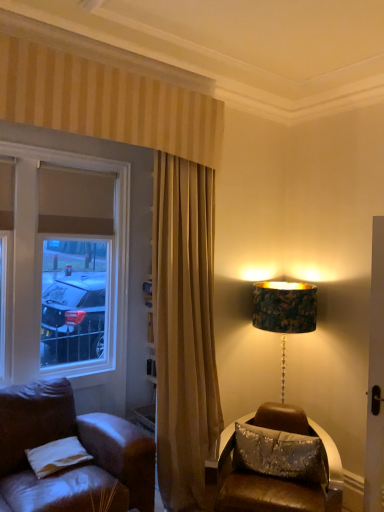
Identify the location of white fabric pillow at lower left, the 2th pillow in the right-to-left sequence. Image resolution: width=384 pixels, height=512 pixels. (56, 456).

What do you see at coordinates (111, 256) in the screenshot? I see `matte glass window at left` at bounding box center [111, 256].

Locate an element on the screen. matte glass window at left is located at coordinates (111, 256).

This screenshot has height=512, width=384. Find the location of `sparkly silver pillow at lower right, which is the 1th pillow from right to left`. sparkly silver pillow at lower right, which is the 1th pillow from right to left is located at coordinates (280, 454).

At what (x,y) coordinates should I click in order to perform the action: click on white fabric pillow at lower left, the 2th pillow in the right-to-left sequence. Please return your answer as a coordinate pair (x, y). Looking at the image, I should click on (56, 456).

How distant is white fabric pillow at lower left, arranged as the first pillow when viewed from the left, from sparkly silver pillow at lower right, the second pillow positioned from the left?

A distance of 3.82 feet exists between white fabric pillow at lower left, arranged as the first pillow when viewed from the left, and sparkly silver pillow at lower right, the second pillow positioned from the left.

Is white fabric pillow at lower left, arranged as the first pillow when viewed from the left, spatially inside sparkly silver pillow at lower right, which is the 1th pillow from right to left, or outside of it?

white fabric pillow at lower left, arranged as the first pillow when viewed from the left, is not inside sparkly silver pillow at lower right, which is the 1th pillow from right to left, it's outside.

Is white fabric pillow at lower left, arranged as the first pillow when viewed from the left, bigger than sparkly silver pillow at lower right, which is the 1th pillow from right to left?

No.

From the image's perspective, between white fabric pillow at lower left, the 2th pillow in the right-to-left sequence, and sparkly silver pillow at lower right, which is the 1th pillow from right to left, who is located below?

From the image's view, white fabric pillow at lower left, the 2th pillow in the right-to-left sequence, is below.

Can you confirm if matte glass window at left is bigger than sparkly silver pillow at lower right, the second pillow positioned from the left?

Yes.

Which object is further away from the camera, matte glass window at left or sparkly silver pillow at lower right, which is the 1th pillow from right to left?

Positioned behind is matte glass window at left.

Does matte glass window at left appear on the right side of sparkly silver pillow at lower right, which is the 1th pillow from right to left?

No.

Would you say white fabric pillow at lower left, the 2th pillow in the right-to-left sequence, is outside shiny brown leather chair at lower right?

Yes, white fabric pillow at lower left, the 2th pillow in the right-to-left sequence, is not within shiny brown leather chair at lower right.

From the picture: Is white fabric pillow at lower left, arranged as the first pillow when viewed from the left, beside shiny brown leather chair at lower right?

No, white fabric pillow at lower left, arranged as the first pillow when viewed from the left, is not with shiny brown leather chair at lower right.

Which point is more forward, (x=71, y=450) or (x=231, y=443)?

Point (x=71, y=450)

Consider the image. Which is closer, (x=113, y=307) or (x=54, y=453)?

Point (x=113, y=307).

Between matte glass window at left and white fabric pillow at lower left, arranged as the first pillow when viewed from the left, which one has larger width?

white fabric pillow at lower left, arranged as the first pillow when viewed from the left.

From the image's perspective, is matte glass window at left over white fabric pillow at lower left, arranged as the first pillow when viewed from the left?

Yes.

Is sparkly silver pillow at lower right, which is the 1th pillow from right to left, facing away from shiny brown leather chair at lower right?

Yes, sparkly silver pillow at lower right, which is the 1th pillow from right to left, is positioned with its back facing shiny brown leather chair at lower right.

Does sparkly silver pillow at lower right, the second pillow positioned from the left, have a smaller size compared to shiny brown leather chair at lower right?

Indeed, sparkly silver pillow at lower right, the second pillow positioned from the left, has a smaller size compared to shiny brown leather chair at lower right.

From the picture: From the image's perspective, which is above, sparkly silver pillow at lower right, which is the 1th pillow from right to left, or shiny brown leather chair at lower right?

sparkly silver pillow at lower right, which is the 1th pillow from right to left, appears higher in the image.

Is sparkly silver pillow at lower right, which is the 1th pillow from right to left, next to shiny brown leather chair at lower right?

Indeed, sparkly silver pillow at lower right, which is the 1th pillow from right to left, and shiny brown leather chair at lower right are beside each other and touching.

Is matte glass window at left positioned far away from shiny brown leather chair at lower right?

Yes.

From a real-world perspective, is matte glass window at left physically above shiny brown leather chair at lower right?

Yes, from a real-world perspective, matte glass window at left is on top of shiny brown leather chair at lower right.

Does matte glass window at left have a larger size compared to shiny brown leather chair at lower right?

Actually, matte glass window at left might be smaller than shiny brown leather chair at lower right.

Find the location of a particular element. window on the left of shiny brown leather chair at lower right is located at coordinates (111, 256).

Would you say white fabric pillow at lower left, the 2th pillow in the right-to-left sequence, is inside or outside matte glass window at left?

white fabric pillow at lower left, the 2th pillow in the right-to-left sequence, is not enclosed by matte glass window at left.

Who is shorter, white fabric pillow at lower left, the 2th pillow in the right-to-left sequence, or matte glass window at left?

With less height is white fabric pillow at lower left, the 2th pillow in the right-to-left sequence.

Is white fabric pillow at lower left, the 2th pillow in the right-to-left sequence, smaller than matte glass window at left?

Indeed, white fabric pillow at lower left, the 2th pillow in the right-to-left sequence, has a smaller size compared to matte glass window at left.

Is white fabric pillow at lower left, arranged as the first pillow when viewed from the left, wider or thinner than matte glass window at left?

Considering their sizes, white fabric pillow at lower left, arranged as the first pillow when viewed from the left, looks broader than matte glass window at left.

The image size is (384, 512). In order to click on pillow below the sparkly silver pillow at lower right, the second pillow positioned from the left (from a real-world perspective) in this screenshot , I will do coord(56,456).

This screenshot has height=512, width=384. There is a sparkly silver pillow at lower right, the second pillow positioned from the left. What are the coordinates of `window above it (from a real-world perspective)` in the screenshot? It's located at (111, 256).

Based on the photo, considering their positions, is shiny brown leather chair at lower right positioned closer to sparkly silver pillow at lower right, which is the 1th pillow from right to left, than white fabric pillow at lower left, the 2th pillow in the right-to-left sequence?

Based on the image, shiny brown leather chair at lower right appears to be nearer to sparkly silver pillow at lower right, which is the 1th pillow from right to left.

Looking at the image, which one is located closer to sparkly silver pillow at lower right, the second pillow positioned from the left, matte glass window at left or white fabric pillow at lower left, the 2th pillow in the right-to-left sequence?

white fabric pillow at lower left, the 2th pillow in the right-to-left sequence, lies closer to sparkly silver pillow at lower right, the second pillow positioned from the left, than the other object.

Estimate the real-world distances between objects in this image. Which object is closer to white fabric pillow at lower left, the 2th pillow in the right-to-left sequence, shiny brown leather chair at lower right or matte glass window at left?

Based on the image, shiny brown leather chair at lower right appears to be nearer to white fabric pillow at lower left, the 2th pillow in the right-to-left sequence.

From the image, which object appears to be nearer to shiny brown leather chair at lower right, matte glass window at left or white fabric pillow at lower left, the 2th pillow in the right-to-left sequence?

white fabric pillow at lower left, the 2th pillow in the right-to-left sequence, is closer to shiny brown leather chair at lower right.

Looking at the image, which one is located further to matte glass window at left, sparkly silver pillow at lower right, which is the 1th pillow from right to left, or white fabric pillow at lower left, the 2th pillow in the right-to-left sequence?

Among the two, sparkly silver pillow at lower right, which is the 1th pillow from right to left, is located further to matte glass window at left.

Considering their positions, is shiny brown leather chair at lower right positioned further to matte glass window at left than sparkly silver pillow at lower right, the second pillow positioned from the left?

The object further to matte glass window at left is sparkly silver pillow at lower right, the second pillow positioned from the left.

Based on their spatial positions, is shiny brown leather chair at lower right or white fabric pillow at lower left, the 2th pillow in the right-to-left sequence, further from matte glass window at left?

shiny brown leather chair at lower right.

Looking at the image, which one is located further to shiny brown leather chair at lower right, matte glass window at left or sparkly silver pillow at lower right, which is the 1th pillow from right to left?

matte glass window at left.

Identify the location of pillow between matte glass window at left and sparkly silver pillow at lower right, which is the 1th pillow from right to left, from left to right. point(56,456).

Find the location of a particular element. This screenshot has height=512, width=384. table between matte glass window at left and sparkly silver pillow at lower right, the second pillow positioned from the left, in the horizontal direction is located at coordinates (277, 462).

Identify the location of table located between white fabric pillow at lower left, the 2th pillow in the right-to-left sequence, and sparkly silver pillow at lower right, the second pillow positioned from the left, in the left-right direction. This screenshot has width=384, height=512. (277, 462).

Find the location of a particular element. pillow situated between matte glass window at left and shiny brown leather chair at lower right from left to right is located at coordinates (56, 456).